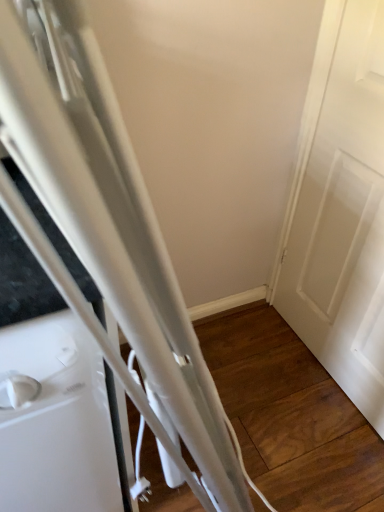
Question: Can you see white matte door at right touching white glossy refrigerator at left?

Choices:
 (A) no
 (B) yes

Answer: (A)

Question: From a real-world perspective, is white matte door at right located beneath white glossy refrigerator at left?

Choices:
 (A) no
 (B) yes

Answer: (A)

Question: Is white matte door at right closer to camera compared to white glossy refrigerator at left?

Choices:
 (A) no
 (B) yes

Answer: (A)

Question: Does white matte door at right have a greater height compared to white glossy refrigerator at left?

Choices:
 (A) no
 (B) yes

Answer: (B)

Question: Does white matte door at right have a smaller size compared to white glossy refrigerator at left?

Choices:
 (A) yes
 (B) no

Answer: (A)

Question: Does white matte door at right appear on the left side of white glossy refrigerator at left?

Choices:
 (A) yes
 (B) no

Answer: (B)

Question: Is white glossy refrigerator at left oriented away from white matte door at right?

Choices:
 (A) yes
 (B) no

Answer: (B)

Question: Considering the relative positions of white glossy refrigerator at left and white matte door at right in the image provided, is white glossy refrigerator at left to the right of white matte door at right from the viewer's perspective?

Choices:
 (A) yes
 (B) no

Answer: (B)

Question: Considering the relative sizes of white glossy refrigerator at left and white matte door at right in the image provided, is white glossy refrigerator at left smaller than white matte door at right?

Choices:
 (A) no
 (B) yes

Answer: (A)

Question: From a real-world perspective, does white glossy refrigerator at left stand above white matte door at right?

Choices:
 (A) no
 (B) yes

Answer: (A)

Question: Could white matte door at right be considered to be inside white glossy refrigerator at left?

Choices:
 (A) no
 (B) yes

Answer: (A)

Question: From the image's perspective, is white glossy refrigerator at left on top of white matte door at right?

Choices:
 (A) no
 (B) yes

Answer: (A)

Question: Is white matte door at right inside or outside of white glossy refrigerator at left?

Choices:
 (A) outside
 (B) inside

Answer: (A)